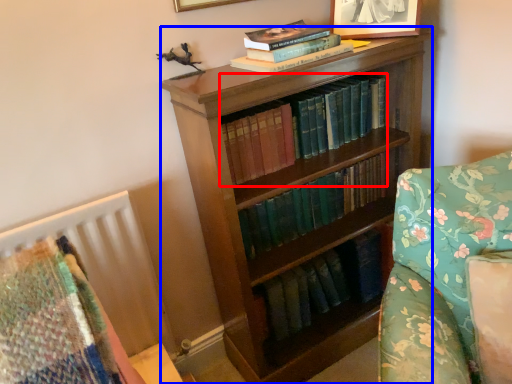
Question: Which object appears farthest to the camera in this image, book (highlighted by a red box) or bookcase (highlighted by a blue box)?

Choices:
 (A) book
 (B) bookcase

Answer: (A)